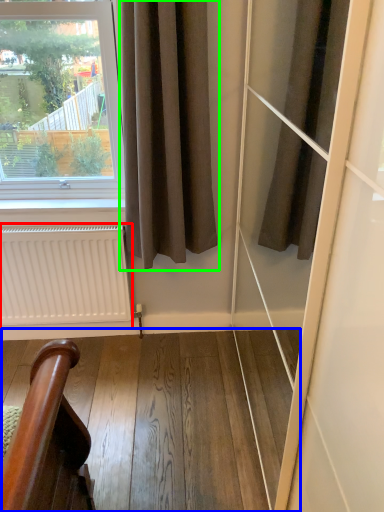
Question: Which object is the farthest from radiator (highlighted by a red box)? Choose among these: stairwell (highlighted by a blue box) or curtain (highlighted by a green box).

Choices:
 (A) stairwell
 (B) curtain

Answer: (B)